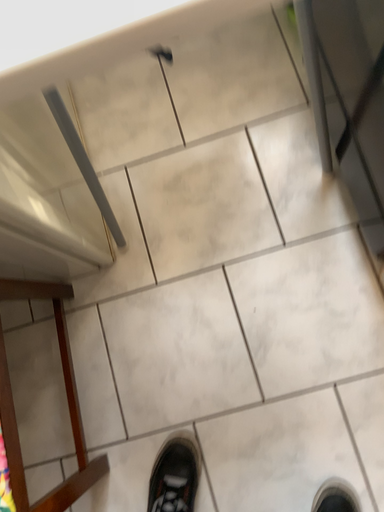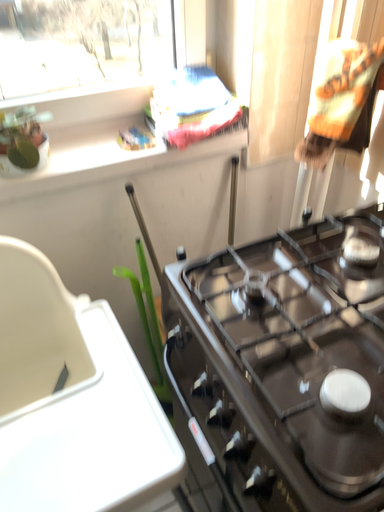
Question: How did the camera likely rotate when shooting the video?

Choices:
 (A) rotated right
 (B) rotated left

Answer: (A)